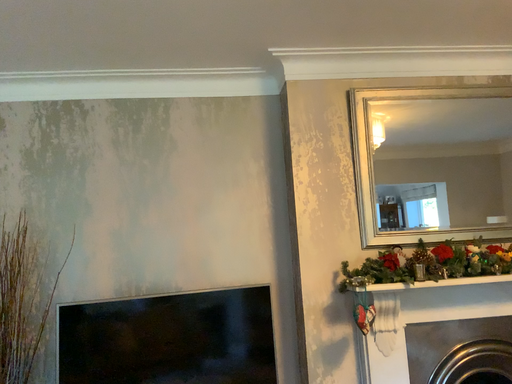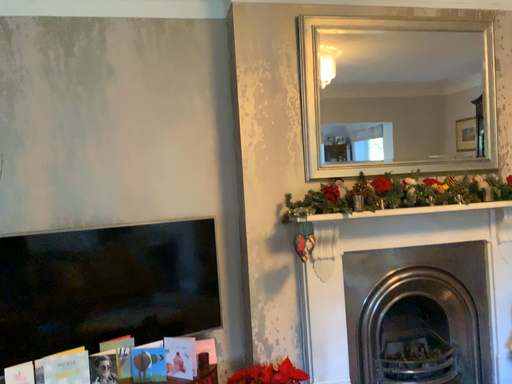
Question: Which way did the camera rotate in the video?

Choices:
 (A) rotated downward
 (B) rotated upward

Answer: (A)